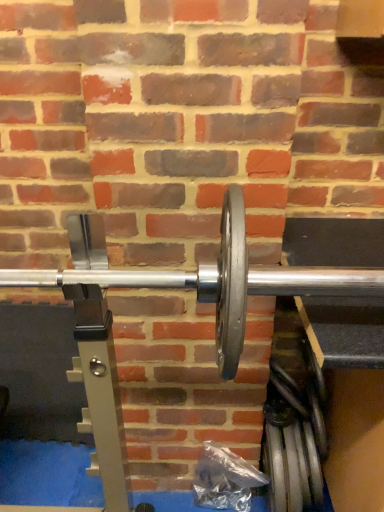
In order to face shiny metallic weight plate at lower right, should I rotate leftwards or rightwards?

It's best to rotate right around 13.275 degrees.

Describe the element at coordinates (292, 467) in the screenshot. I see `shiny metallic weight plate at lower right` at that location.

I want to click on shiny metallic weight plate at lower right, so click(x=292, y=467).

What are the coordinates of `silver metallic dumbbell at center` in the screenshot? It's located at (x=202, y=277).

The width and height of the screenshot is (384, 512). Describe the element at coordinates (202, 277) in the screenshot. I see `silver metallic dumbbell at center` at that location.

The width and height of the screenshot is (384, 512). Identify the location of shiny metallic weight plate at lower right. pyautogui.click(x=292, y=467).

Is shiny metallic weight plate at lower right at the right side of silver metallic dumbbell at center?

Correct, you'll find shiny metallic weight plate at lower right to the right of silver metallic dumbbell at center.

Does shiny metallic weight plate at lower right lie behind silver metallic dumbbell at center?

Yes, the depth of shiny metallic weight plate at lower right is greater than that of silver metallic dumbbell at center.

Which point is more forward, (273, 492) or (364, 277)?

The point (364, 277) is more forward.

From the image's perspective, would you say shiny metallic weight plate at lower right is positioned over silver metallic dumbbell at center?

→ Incorrect, from the image's perspective, shiny metallic weight plate at lower right is lower than silver metallic dumbbell at center.

From a real-world perspective, is shiny metallic weight plate at lower right on top of silver metallic dumbbell at center?

No, from a real-world perspective, shiny metallic weight plate at lower right is not over silver metallic dumbbell at center

Is shiny metallic weight plate at lower right wider or thinner than silver metallic dumbbell at center?

shiny metallic weight plate at lower right is thinner than silver metallic dumbbell at center.

Considering the relative sizes of shiny metallic weight plate at lower right and silver metallic dumbbell at center in the image provided, is shiny metallic weight plate at lower right shorter than silver metallic dumbbell at center?

In fact, shiny metallic weight plate at lower right may be taller than silver metallic dumbbell at center.

Looking at the image, does shiny metallic weight plate at lower right seem bigger or smaller compared to silver metallic dumbbell at center?

shiny metallic weight plate at lower right is smaller than silver metallic dumbbell at center.

Can we say shiny metallic weight plate at lower right lies outside silver metallic dumbbell at center?

Absolutely, shiny metallic weight plate at lower right is external to silver metallic dumbbell at center.

Is shiny metallic weight plate at lower right not close to silver metallic dumbbell at center?

shiny metallic weight plate at lower right is near silver metallic dumbbell at center, not far away.

Is shiny metallic weight plate at lower right oriented away from silver metallic dumbbell at center?

No, shiny metallic weight plate at lower right is not facing the opposite direction of silver metallic dumbbell at center.

How different are the orientations of shiny metallic weight plate at lower right and silver metallic dumbbell at center in degrees?

The angular difference between shiny metallic weight plate at lower right and silver metallic dumbbell at center is 0.763 degrees.

Measure the distance between shiny metallic weight plate at lower right and silver metallic dumbbell at center.

shiny metallic weight plate at lower right is 69.15 centimeters away from silver metallic dumbbell at center.

Find the location of a particular element. The height and width of the screenshot is (512, 384). tire behind the silver metallic dumbbell at center is located at coordinates (292, 467).

Based on their positions, is silver metallic dumbbell at center located to the left or right of shiny metallic weight plate at lower right?

In the image, silver metallic dumbbell at center appears on the left side of shiny metallic weight plate at lower right.

Is silver metallic dumbbell at center positioned before shiny metallic weight plate at lower right?

Yes, silver metallic dumbbell at center is in front of shiny metallic weight plate at lower right.

Considering the points (262, 282) and (272, 474), which point is in front, point (262, 282) or point (272, 474)?

Positioned in front is point (262, 282).

From the image's perspective, which is below, silver metallic dumbbell at center or shiny metallic weight plate at lower right?

shiny metallic weight plate at lower right is shown below in the image.

From the picture: From a real-world perspective, between silver metallic dumbbell at center and shiny metallic weight plate at lower right, who is vertically higher?

silver metallic dumbbell at center, from a real-world perspective.

Is silver metallic dumbbell at center thinner than shiny metallic weight plate at lower right?

In fact, silver metallic dumbbell at center might be wider than shiny metallic weight plate at lower right.

Does silver metallic dumbbell at center have a greater height compared to shiny metallic weight plate at lower right?

Incorrect, the height of silver metallic dumbbell at center is not larger of that of shiny metallic weight plate at lower right.

Is silver metallic dumbbell at center smaller than shiny metallic weight plate at lower right?

Incorrect, silver metallic dumbbell at center is not smaller in size than shiny metallic weight plate at lower right.

Is silver metallic dumbbell at center inside or outside of shiny metallic weight plate at lower right?

silver metallic dumbbell at center lies outside shiny metallic weight plate at lower right.

Is silver metallic dumbbell at center placed right next to shiny metallic weight plate at lower right?

No, silver metallic dumbbell at center is not in contact with shiny metallic weight plate at lower right.

Could you tell me if silver metallic dumbbell at center is facing shiny metallic weight plate at lower right?

No, silver metallic dumbbell at center does not turn towards shiny metallic weight plate at lower right.

Find the location of a particular element. This screenshot has height=512, width=384. dumbbell above the shiny metallic weight plate at lower right (from the image's perspective) is located at coordinates point(202,277).

Find the location of a particular element. dumbbell lying above the shiny metallic weight plate at lower right (from the image's perspective) is located at coordinates (202, 277).

The height and width of the screenshot is (512, 384). Find the location of `dumbbell that appears on the left of shiny metallic weight plate at lower right`. dumbbell that appears on the left of shiny metallic weight plate at lower right is located at coordinates (202, 277).